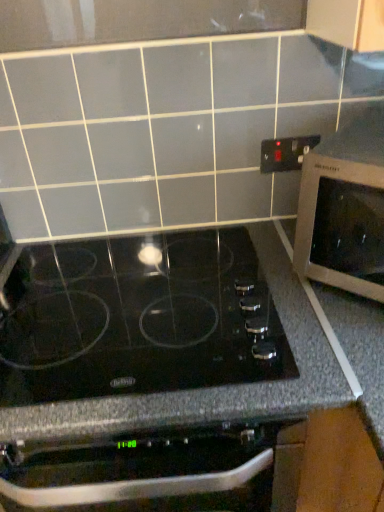
Question: Is silver metallic microwave at right outside of black plastic electrical outlet at upper right?

Choices:
 (A) yes
 (B) no

Answer: (A)

Question: From a real-world perspective, does silver metallic microwave at right sit lower than black plastic electrical outlet at upper right?

Choices:
 (A) yes
 (B) no

Answer: (A)

Question: Is the position of silver metallic microwave at right more distant than that of black plastic electrical outlet at upper right?

Choices:
 (A) no
 (B) yes

Answer: (A)

Question: From a real-world perspective, is silver metallic microwave at right located higher than black plastic electrical outlet at upper right?

Choices:
 (A) no
 (B) yes

Answer: (A)

Question: From the image's perspective, is silver metallic microwave at right beneath black plastic electrical outlet at upper right?

Choices:
 (A) no
 (B) yes

Answer: (B)

Question: Is silver metallic microwave at right situated inside black plastic electrical outlet at upper right or outside?

Choices:
 (A) inside
 (B) outside

Answer: (B)

Question: Does point (307, 199) appear closer or farther from the camera than point (294, 138)?

Choices:
 (A) closer
 (B) farther

Answer: (A)

Question: Is silver metallic microwave at right wider or thinner than black plastic electrical outlet at upper right?

Choices:
 (A) thin
 (B) wide

Answer: (B)

Question: In terms of height, does silver metallic microwave at right look taller or shorter compared to black plastic electrical outlet at upper right?

Choices:
 (A) short
 (B) tall

Answer: (B)

Question: Considering the positions of point (314, 135) and point (92, 445), is point (314, 135) closer or farther from the camera than point (92, 445)?

Choices:
 (A) farther
 (B) closer

Answer: (A)

Question: Considering the positions of black plastic electrical outlet at upper right and black glass cooktop at center in the image, is black plastic electrical outlet at upper right wider or thinner than black glass cooktop at center?

Choices:
 (A) wide
 (B) thin

Answer: (B)

Question: In the image, is black plastic electrical outlet at upper right on the left side or the right side of black glass cooktop at center?

Choices:
 (A) right
 (B) left

Answer: (A)

Question: Considering the positions of black plastic electrical outlet at upper right and black glass cooktop at center in the image, is black plastic electrical outlet at upper right taller or shorter than black glass cooktop at center?

Choices:
 (A) tall
 (B) short

Answer: (B)

Question: From a real-world perspective, is black glass cooktop at center positioned above or below black plastic electrical outlet at upper right?

Choices:
 (A) below
 (B) above

Answer: (A)

Question: Is black glass cooktop at center wider or thinner than black plastic electrical outlet at upper right?

Choices:
 (A) wide
 (B) thin

Answer: (A)